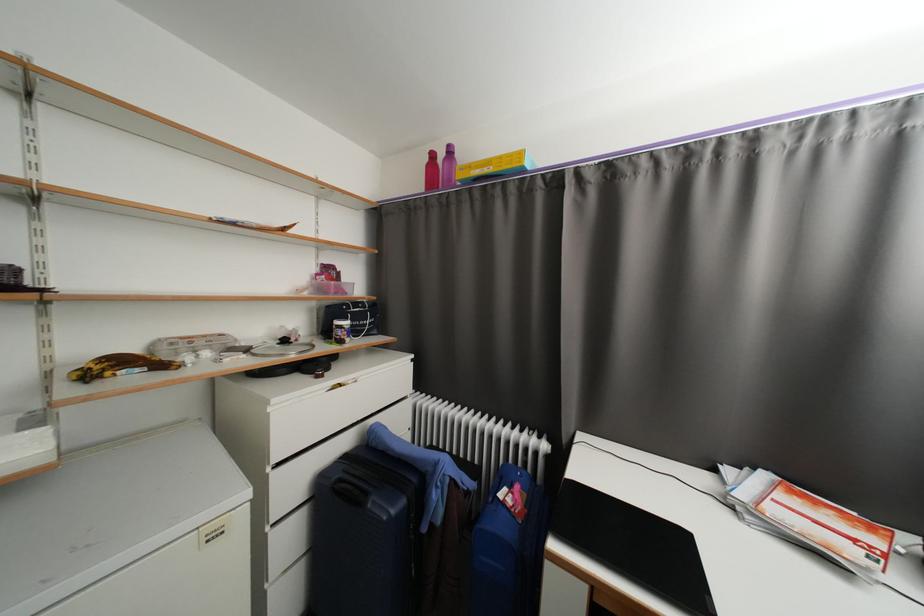
Where would you lift the closed black laptop? Please return your answer as a coordinate pair (x, y).

(634, 545)